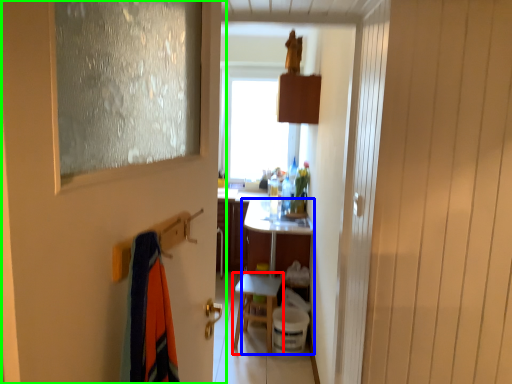
Question: Estimate the real-world distances between objects in this image. Which object is closer to table (highlighted by a red box), vanity (highlighted by a blue box) or door (highlighted by a green box)?

Choices:
 (A) vanity
 (B) door

Answer: (A)